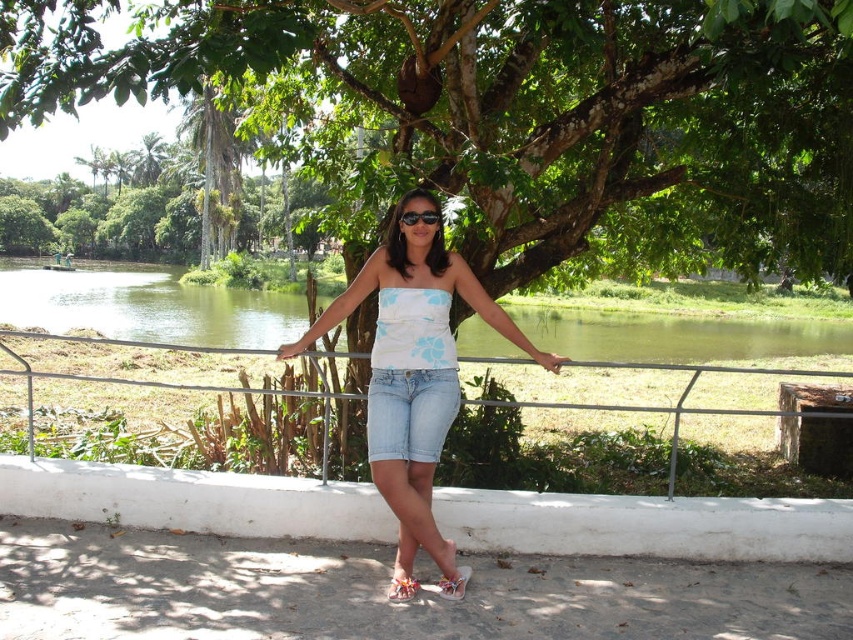
You are a photographer taking a picture of the woman in the scene. You notice the metallic silver fence at center and the black plastic sunglasses at center. Which object is closer to the camera?

The metallic silver fence at center is below the black plastic sunglasses at center, meaning the sunglasses are closer to the camera.

You are a photographer trying to capture the woman in the scene. You notice the metallic silver fence at center and the black plastic sunglasses at center. Since you want to ensure the sunglasses are visible in your photo, which object should you focus on to avoid obstruction?

A: The metallic silver fence at center is taller than the black plastic sunglasses at center. To ensure the sunglasses are visible, focus on the sunglasses since the fence is taller and might block the view if not positioned carefully.

You are standing at the point closer to the camera in the image. Which point are you at, point (x=838, y=54) or point (x=367, y=417)?

You are at point (x=838, y=54) because it is further to the camera than point (x=367, y=417).